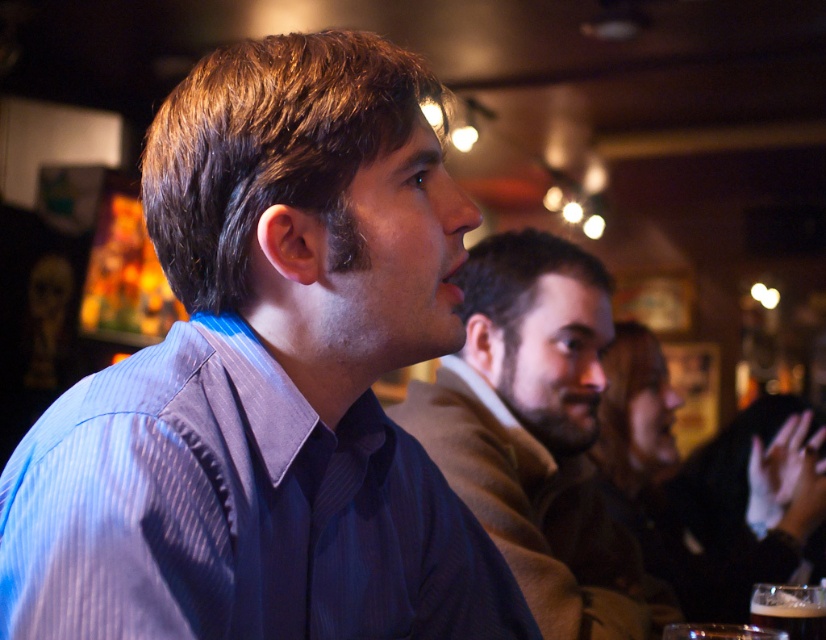
Question: Is the position of blue striped shirt at center less distant than that of matte blue shirt at center?

Choices:
 (A) yes
 (B) no

Answer: (A)

Question: Can you confirm if blue striped shirt at center is bigger than matte blue shirt at center?

Choices:
 (A) no
 (B) yes

Answer: (A)

Question: Which object is positioned farthest from the dark brown glass at lower right?

Choices:
 (A) blue striped shirt at center
 (B) matte blue shirt at center

Answer: (B)

Question: Based on their relative distances, which object is farther from the matte blue shirt at center?

Choices:
 (A) dark brown glass at lower right
 (B) blue striped shirt at center

Answer: (A)

Question: Estimate the real-world distances between objects in this image. Which object is closer to the blue striped shirt at center?

Choices:
 (A) dark brown glass at lower right
 (B) matte blue shirt at center

Answer: (A)

Question: Is blue striped shirt at center bigger than matte blue shirt at center?

Choices:
 (A) yes
 (B) no

Answer: (B)